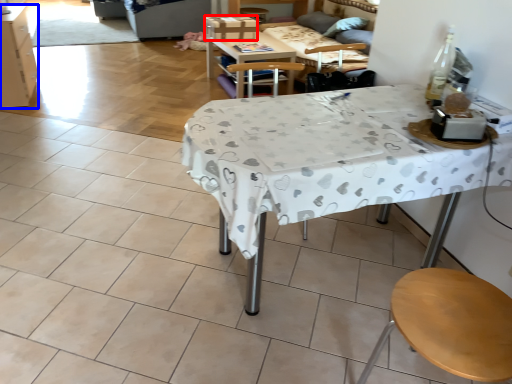
Question: Which object appears closest to the camera in this image, box (highlighted by a red box) or cabinetry (highlighted by a blue box)?

Choices:
 (A) box
 (B) cabinetry

Answer: (B)